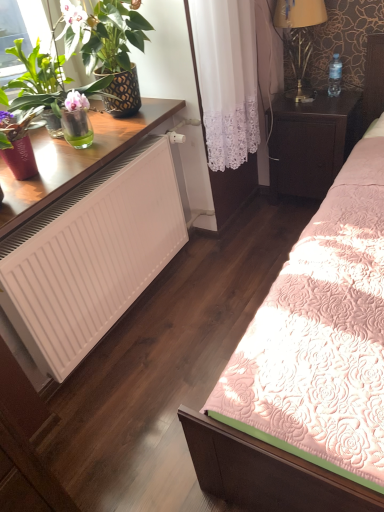
Question: Do you think white matte radiator at lower left is within gold metallic lamp at upper right, or outside of it?

Choices:
 (A) outside
 (B) inside

Answer: (A)

Question: Based on their positions, is white matte radiator at lower left located to the left or right of gold metallic lamp at upper right?

Choices:
 (A) right
 (B) left

Answer: (B)

Question: Considering the real-world distances, which object is farthest from the gold metallic lamp at upper right?

Choices:
 (A) pink floral quilt at center
 (B) dark wood nightstand at right
 (C) matte black pot at left
 (D) transparent plastic bottle at upper right
 (E) white lace curtain at center

Answer: (A)

Question: Which object is positioned farthest from the white lace curtain at center?

Choices:
 (A) gold metallic lamp at upper right
 (B) matte black pot at left
 (C) transparent plastic bottle at upper right
 (D) white matte radiator at lower left
 (E) wooden desk at left

Answer: (C)